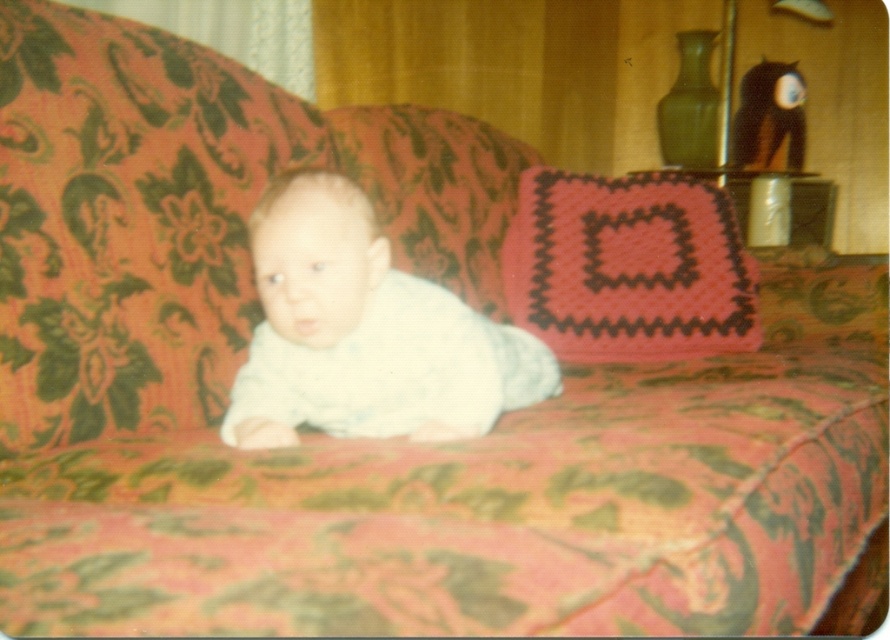
You are a photographer setting up for a baby photoshoot. You need to position the white soft fabric baby at center and the knitted pink pillow at center in a way that the baby is looking towards the pillow. Based on their current positions, is the baby already facing the correct direction?

The white soft fabric baby at center is positioned on the left side of the knitted pink pillow at center, so the baby is facing towards the pillow as it is looking off to the side towards the pillow.